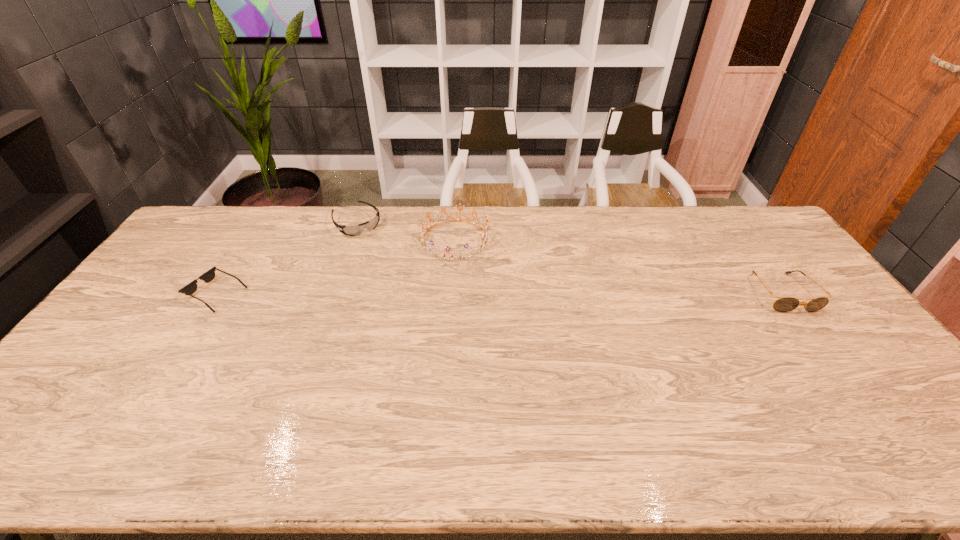
This screenshot has width=960, height=540. Identify the location of vacant spot on the desktop that is between the leftmost object and the tallest sunglasses and is positioned on the front-facing side of the tallest object. (567, 293).

The width and height of the screenshot is (960, 540). Find the location of `free space on the desktop that is between the leftmost sunglasses and the tallest sunglasses and is positioned on the lenses of the third object from right to left`. free space on the desktop that is between the leftmost sunglasses and the tallest sunglasses and is positioned on the lenses of the third object from right to left is located at coordinates (422, 293).